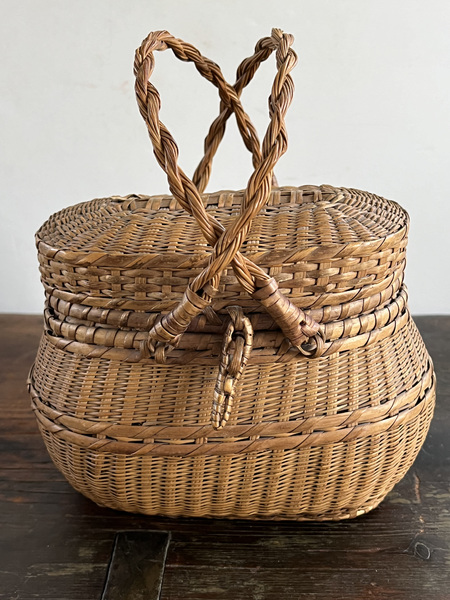
The width and height of the screenshot is (450, 600). What are the coordinates of `white background wall` in the screenshot? It's located at (435, 204), (395, 121), (328, 142), (344, 48), (90, 49), (37, 188).